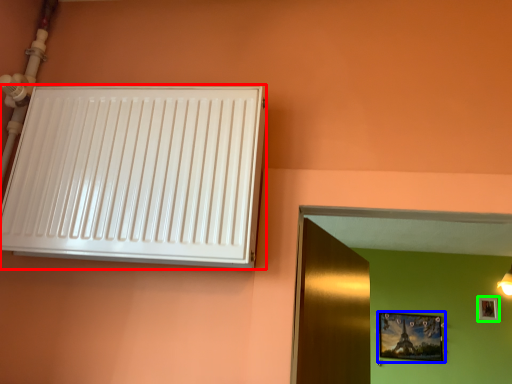
Question: Based on their relative distances, which object is nearer to air conditioning (highlighted by a red box)? Choose from picture frame (highlighted by a blue box) and picture frame (highlighted by a green box).

Choices:
 (A) picture frame
 (B) picture frame

Answer: (A)